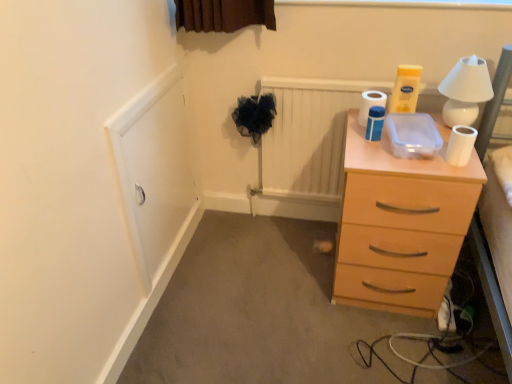
Locate an element on the screen. Image resolution: width=512 pixels, height=384 pixels. free space to the back side of white matte toilet paper at upper right, the first toilet paper viewed from the front is located at coordinates (437, 139).